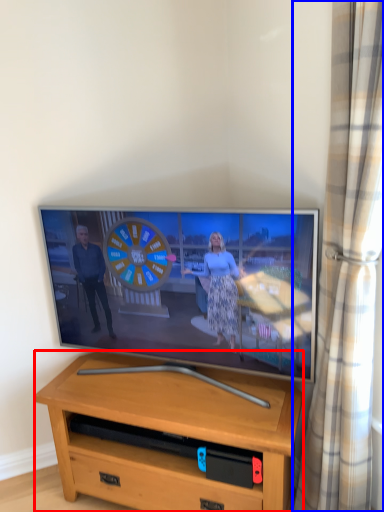
Question: Which of the following is the closest to the observer, desk (highlighted by a red box) or curtain (highlighted by a blue box)?

Choices:
 (A) desk
 (B) curtain

Answer: (B)